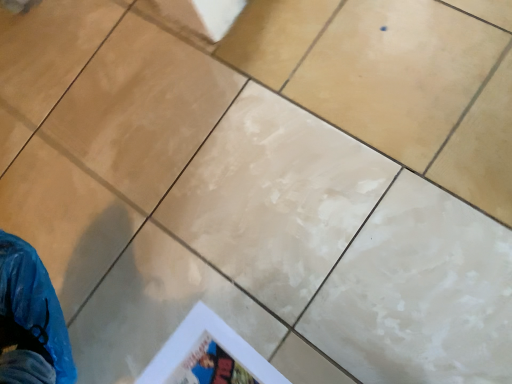
Question: Can you confirm if white paper poster at lower center is wider than matte beige tile at center?

Choices:
 (A) no
 (B) yes

Answer: (A)

Question: Could you tell me if white paper poster at lower center is facing matte beige tile at center?

Choices:
 (A) no
 (B) yes

Answer: (A)

Question: Is white paper poster at lower center in front of matte beige tile at center?

Choices:
 (A) yes
 (B) no

Answer: (A)

Question: Can you confirm if white paper poster at lower center is positioned to the left of matte beige tile at center?

Choices:
 (A) no
 (B) yes

Answer: (B)

Question: From the image's perspective, is white paper poster at lower center under matte beige tile at center?

Choices:
 (A) no
 (B) yes

Answer: (B)

Question: Does white paper poster at lower center come behind matte beige tile at center?

Choices:
 (A) no
 (B) yes

Answer: (A)

Question: Considering the relative positions of matte beige tile at center and white paper poster at lower center in the image provided, is matte beige tile at center to the right of white paper poster at lower center from the viewer's perspective?

Choices:
 (A) yes
 (B) no

Answer: (A)

Question: Considering the relative sizes of matte beige tile at center and white paper poster at lower center in the image provided, is matte beige tile at center smaller than white paper poster at lower center?

Choices:
 (A) yes
 (B) no

Answer: (B)

Question: Is matte beige tile at center completely or partially outside of white paper poster at lower center?

Choices:
 (A) yes
 (B) no

Answer: (A)

Question: Does matte beige tile at center have a lesser height compared to white paper poster at lower center?

Choices:
 (A) yes
 (B) no

Answer: (A)

Question: Can you confirm if matte beige tile at center is bigger than white paper poster at lower center?

Choices:
 (A) yes
 (B) no

Answer: (A)

Question: From a real-world perspective, does matte beige tile at center stand above white paper poster at lower center?

Choices:
 (A) yes
 (B) no

Answer: (A)

Question: Considering their positions, is white paper poster at lower center located in front of or behind matte beige tile at center?

Choices:
 (A) behind
 (B) front

Answer: (B)